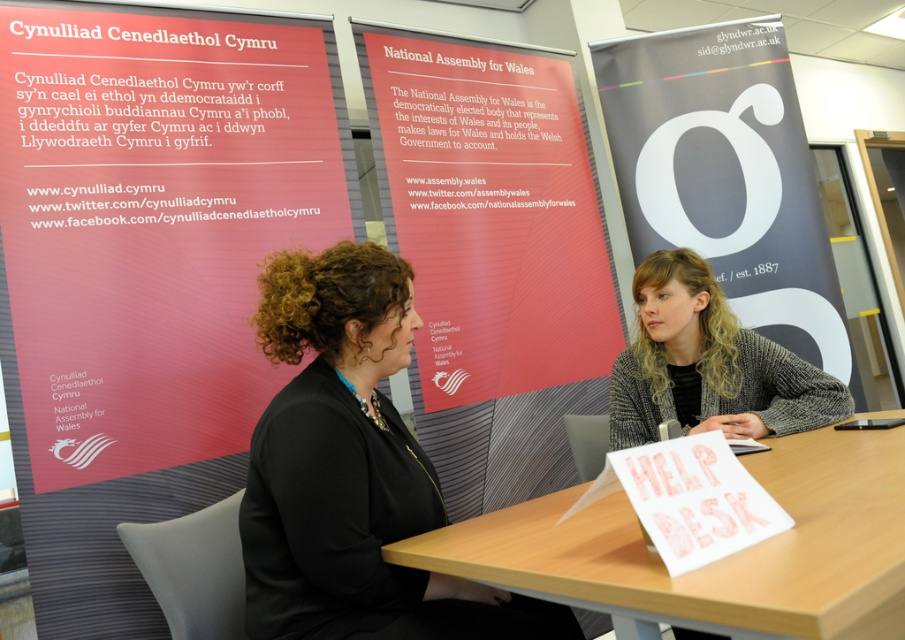
Does matte red banner at left lie behind matte red banner at center?

No, it is not.

Can you confirm if matte red banner at left is smaller than matte red banner at center?

Indeed, matte red banner at left has a smaller size compared to matte red banner at center.

Does point (43, 209) come in front of point (437, 288)?

Yes, point (43, 209) is closer to viewer.

Locate an element on the screen. The width and height of the screenshot is (905, 640). matte red banner at left is located at coordinates (157, 220).

Between matte red banner at center and gray woolen sweater at center, which one has more height?

matte red banner at center is taller.

Which of these two, matte red banner at center or gray woolen sweater at center, stands shorter?

gray woolen sweater at center

Is point (540, 76) less distant than point (813, 374)?

No.

This screenshot has width=905, height=640. I want to click on matte red banner at center, so click(491, 212).

Between wooden at center and gray woolen sweater at center, which one appears on the right side from the viewer's perspective?

gray woolen sweater at center

Which is in front, point (595, 588) or point (680, 250)?

Point (595, 588) is in front.

Identify the location of wooden at center. Image resolution: width=905 pixels, height=640 pixels. (713, 561).